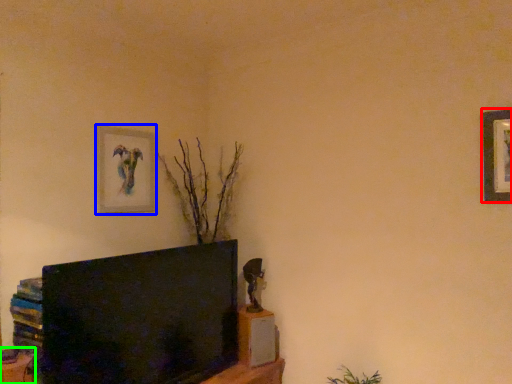
Question: Which object is the farthest from picture frame (highlighted by a red box)? Choose among these: picture frame (highlighted by a blue box) or furniture (highlighted by a green box).

Choices:
 (A) picture frame
 (B) furniture

Answer: (B)